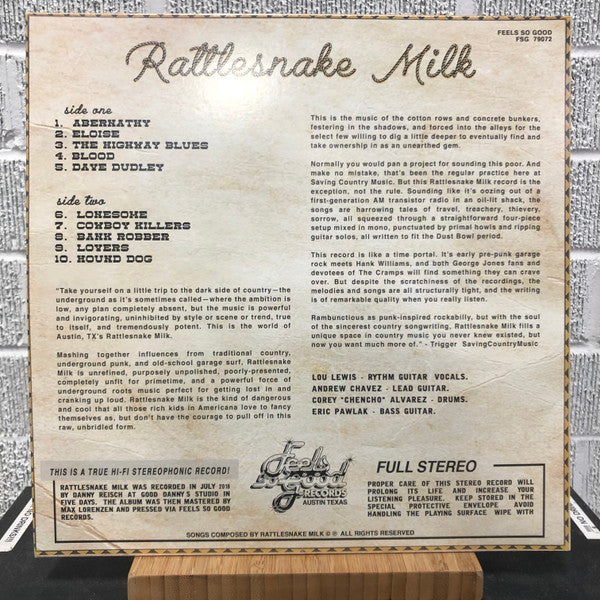
Find the location of a particular element. The image size is (600, 600). black display platform is located at coordinates (75, 587), (514, 575).